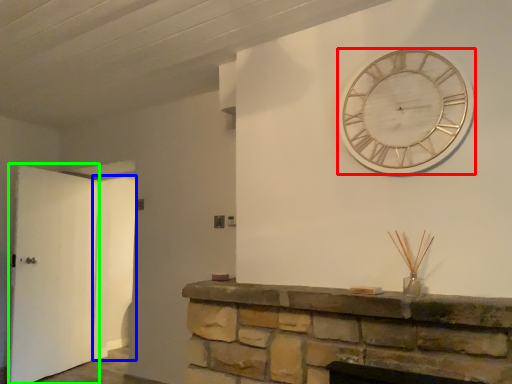
Question: Based on their relative distances, which object is farther from wall clock (highlighted by a red box)? Choose from door (highlighted by a blue box) and door (highlighted by a green box).

Choices:
 (A) door
 (B) door

Answer: (A)